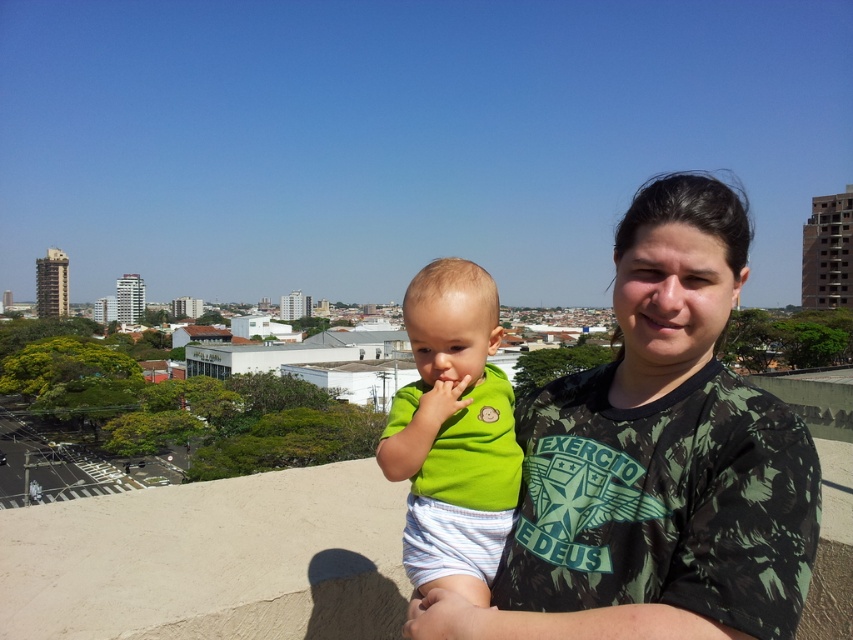
Question: Is green camouflage shirt at center above green matte shirt at center?

Choices:
 (A) yes
 (B) no

Answer: (A)

Question: Does green camouflage shirt at center appear over green matte shirt at center?

Choices:
 (A) yes
 (B) no

Answer: (A)

Question: Which point appears farthest from the camera in this image?

Choices:
 (A) (474, 460)
 (B) (714, 342)

Answer: (B)

Question: Which point is farther to the camera?

Choices:
 (A) green camouflage shirt at center
 (B) green matte shirt at center

Answer: (B)

Question: Considering the relative positions of green camouflage shirt at center and green matte shirt at center in the image provided, where is green camouflage shirt at center located with respect to green matte shirt at center?

Choices:
 (A) right
 (B) left

Answer: (A)